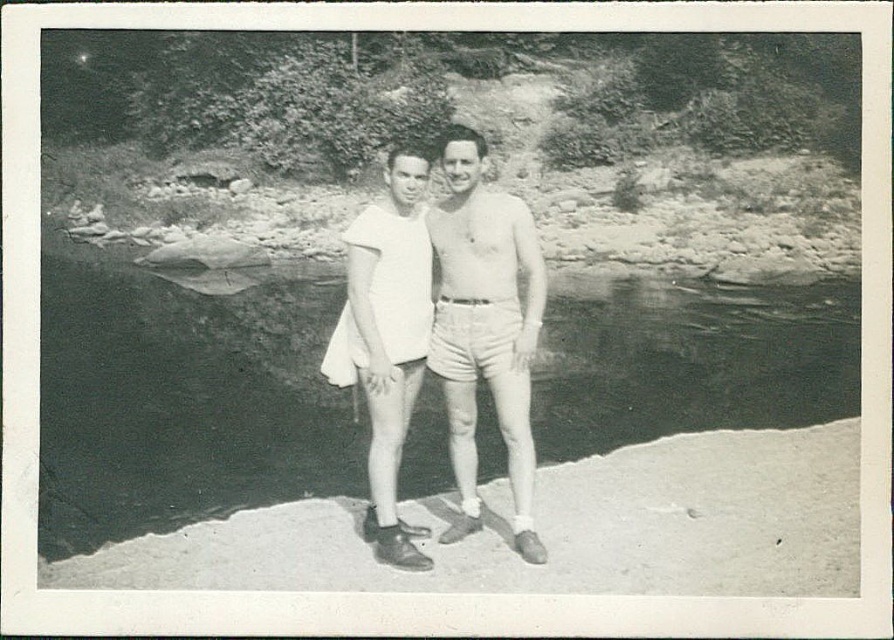
You are standing at the point labeled as point (182, 403) in the image. What is the object located exactly at that coordinate?

The point (182, 403) indicates black water at center.

Based on the scene described, which object, the black water at center or the white cotton shirt at center, is positioned higher in the image?

The black water at center is taller than the white cotton shirt at center, so the black water at center is positioned higher.

In the black and white photo, there are two people near a river. The black water at center and the white cotton shirt at center are both visible. Which object is located to the left of the other?

The black water at center is positioned on the left side of white cotton shirt at center.